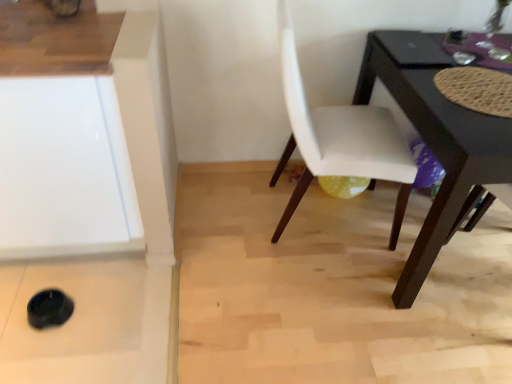
I want to click on free region under white leather chair at center (from a real-world perspective), so click(315, 219).